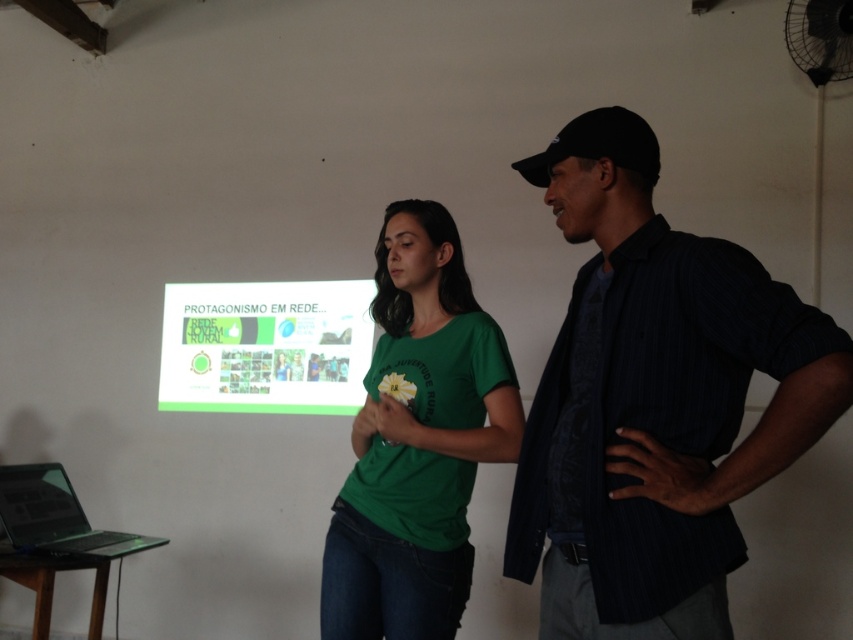
Question: Where is green matte projector screen at center located in relation to black glossy laptop at lower left in the image?

Choices:
 (A) left
 (B) right

Answer: (B)

Question: Which point is closer to the camera taking this photo?

Choices:
 (A) (407, 467)
 (B) (312, 406)

Answer: (A)

Question: Considering the relative positions of green matte t-shirt at center and black glossy laptop at lower left in the image provided, where is green matte t-shirt at center located with respect to black glossy laptop at lower left?

Choices:
 (A) below
 (B) above

Answer: (B)

Question: Is green matte projector screen at center above black glossy laptop at lower left?

Choices:
 (A) yes
 (B) no

Answer: (A)

Question: Estimate the real-world distances between objects in this image. Which object is farther from the black glossy laptop at lower left?

Choices:
 (A) dark blue striped shirt at right
 (B) green matte t-shirt at center
 (C) green matte projector screen at center

Answer: (A)

Question: Based on their relative distances, which object is nearer to the green matte t-shirt at center?

Choices:
 (A) black glossy laptop at lower left
 (B) green matte projector screen at center
 (C) dark blue striped shirt at right

Answer: (C)